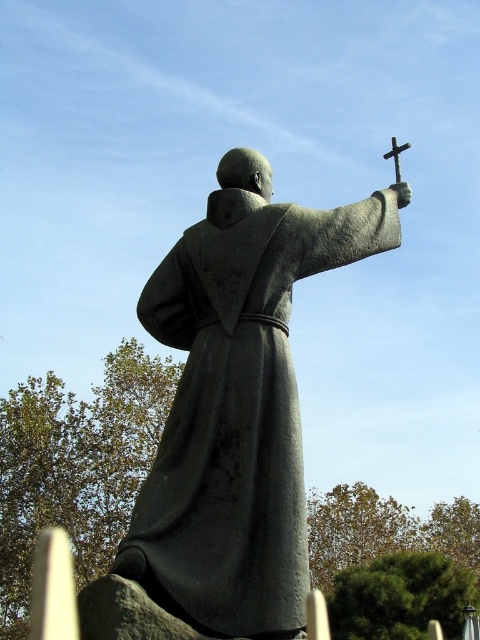
You are a visitor at a historical site and see the gray stone statue at center and the polished silver cross at upper right. Which object is located to the right of the other?

The gray stone statue at center is positioned on the left side of polished silver cross at upper right, so the polished silver cross at upper right is to the right of the gray stone statue at center.

You are standing at the entrance of a garden and see the gray stone statue at center. If you walk straight ahead, will the statue remain in your line of sight?

The gray stone statue at center is located at point (238,403), which means it is positioned directly ahead in the center of your view. Therefore, walking straight ahead will keep the statue in your line of sight.

You are an art conservator assessing the statue and its accessories. Given that the gray stone statue at center is larger than the polished silver cross at upper right, which object would require more space for storage or transportation?

The gray stone statue at center requires more space for storage or transportation because it is larger than the polished silver cross at upper right.